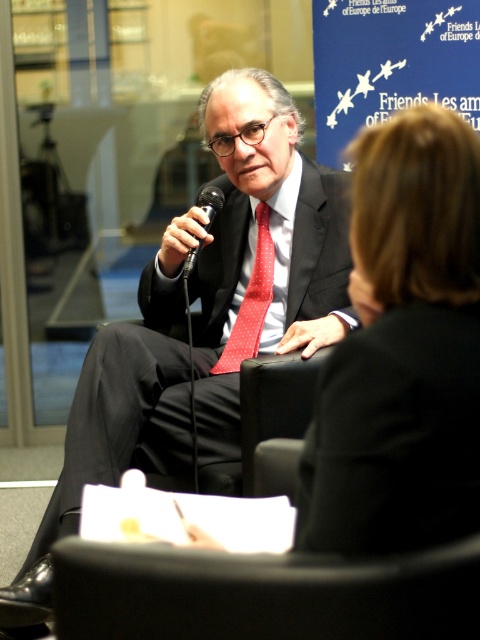
You are organizing a small event and need to place a decorative pillow that is 1.2 meters wide between the black leather jacket at upper right and the black leather chair at lower center. Based on their widths, will the pillow fit between them?

The black leather jacket at upper right is narrower than the black leather chair at lower center. However, the total width of both objects combined is not provided, so we cannot determine if the 1.2 meter pillow will fit between them.

You are a photographer standing in front of the scene described. You want to take a photo of the black leather chair at lower center without including the black leather jacket at upper right in the frame. Is this possible based on their positions?

The black leather chair at lower center is behind the black leather jacket at upper right, so it is possible to position yourself or adjust the camera angle to exclude the jacket from the frame while capturing the chair.

You are a photographer standing behind the matte black suit at center and the black leather chair at lower center. You want to take a photo of the scene without any obstruction. Which object should you move to ensure the other is fully visible?

The matte black suit at center is positioned over the black leather chair at lower center. To ensure the black leather chair at lower center is fully visible, you should move the matte black suit at center.